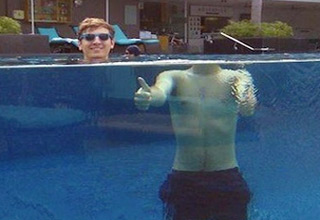
Where is `shades`? shades is located at coordinates (103, 37).